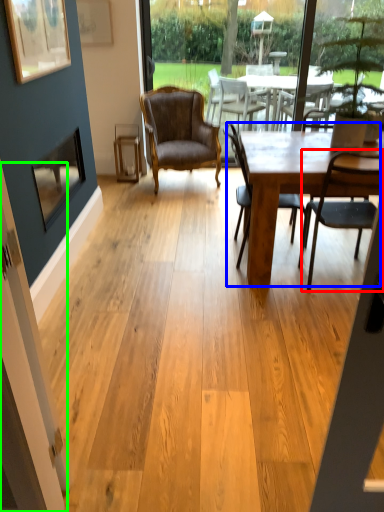
Question: Which object is the farthest from chair (highlighted by a red box)? Choose among these: kitchen & dining room table (highlighted by a blue box) or screen door (highlighted by a green box).

Choices:
 (A) kitchen & dining room table
 (B) screen door

Answer: (B)